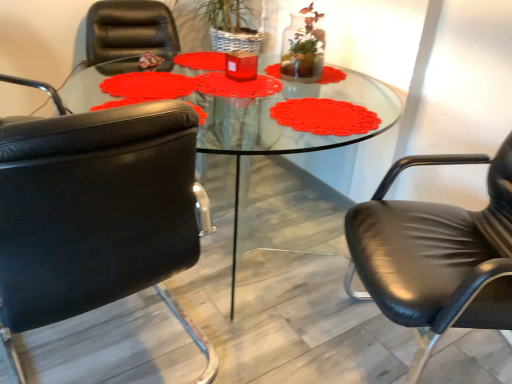
Question: Does black leather chair at left, the first chair from the left, come in front of transparent glass table at center?

Choices:
 (A) no
 (B) yes

Answer: (B)

Question: Can you confirm if black leather chair at left, the 2th chair in the right-to-left sequence, is shorter than transparent glass table at center?

Choices:
 (A) yes
 (B) no

Answer: (B)

Question: Could you tell me if black leather chair at left, the 2th chair in the right-to-left sequence, is turned towards transparent glass table at center?

Choices:
 (A) yes
 (B) no

Answer: (B)

Question: Is black leather chair at left, the first chair from the left, thinner than transparent glass table at center?

Choices:
 (A) yes
 (B) no

Answer: (A)

Question: Is black leather chair at left, the first chair from the left, far away from transparent glass table at center?

Choices:
 (A) yes
 (B) no

Answer: (A)

Question: Considering the relative sizes of black leather chair at left, the first chair from the left, and transparent glass table at center in the image provided, is black leather chair at left, the first chair from the left, smaller than transparent glass table at center?

Choices:
 (A) no
 (B) yes

Answer: (B)

Question: From a real-world perspective, is translucent glass vase at upper center located beneath black leather chair at left, the 2th chair in the right-to-left sequence?

Choices:
 (A) no
 (B) yes

Answer: (A)

Question: Is translucent glass vase at upper center at the left side of black leather chair at left, the 2th chair in the right-to-left sequence?

Choices:
 (A) no
 (B) yes

Answer: (A)

Question: Considering the relative sizes of translucent glass vase at upper center and black leather chair at left, the first chair from the left, in the image provided, is translucent glass vase at upper center shorter than black leather chair at left, the first chair from the left,?

Choices:
 (A) yes
 (B) no

Answer: (A)

Question: Is translucent glass vase at upper center not inside black leather chair at left, the 2th chair in the right-to-left sequence?

Choices:
 (A) no
 (B) yes

Answer: (B)

Question: Is black leather chair at left, the first chair from the left, at the back of translucent glass vase at upper center?

Choices:
 (A) no
 (B) yes

Answer: (A)

Question: Is translucent glass vase at upper center surrounding black leather chair at left, the 2th chair in the right-to-left sequence?

Choices:
 (A) yes
 (B) no

Answer: (B)

Question: Is transparent glass table at center at the back of translucent glass vase at upper center?

Choices:
 (A) no
 (B) yes

Answer: (A)